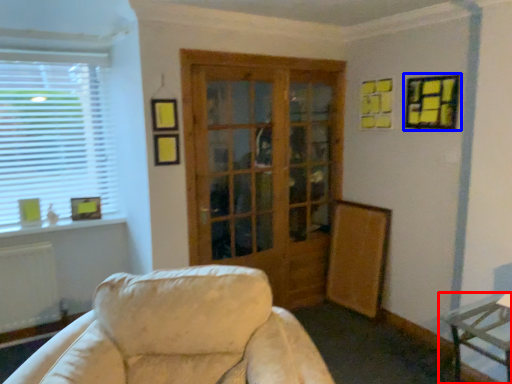
Question: Among these objects, which one is farthest to the camera, table (highlighted by a red box) or picture frame (highlighted by a blue box)?

Choices:
 (A) table
 (B) picture frame

Answer: (B)